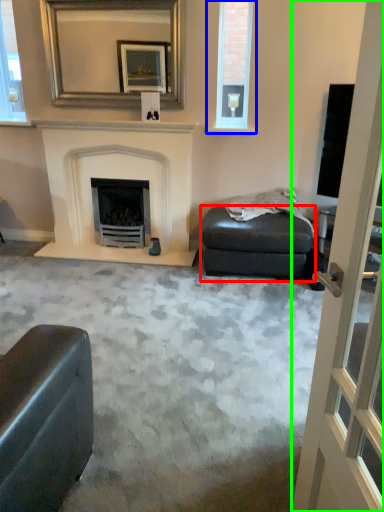
Question: Which is farther away from footrest (highlighted by a red box)? window (highlighted by a blue box) or screen door (highlighted by a green box)?

Choices:
 (A) window
 (B) screen door

Answer: (B)